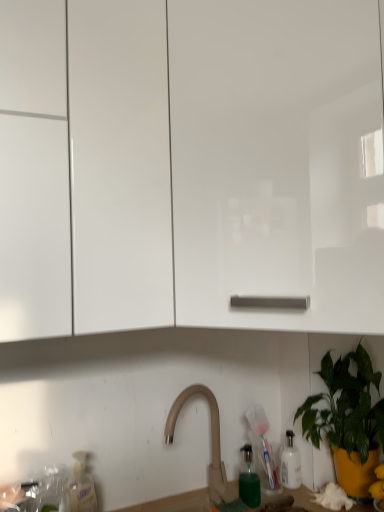
Question: Could beige matte faucet at center be considered to be inside white glossy cabinet at upper left, arranged as the 2th cabinetry when viewed from the right?

Choices:
 (A) yes
 (B) no

Answer: (B)

Question: Does white glossy cabinet at upper left, the first cabinetry from the left, have a lesser width compared to beige matte faucet at center?

Choices:
 (A) yes
 (B) no

Answer: (B)

Question: Is white glossy cabinet at upper left, arranged as the 2th cabinetry when viewed from the right, not within beige matte faucet at center?

Choices:
 (A) yes
 (B) no

Answer: (A)

Question: Is there a large distance between white glossy cabinet at upper left, the first cabinetry from the left, and beige matte faucet at center?

Choices:
 (A) no
 (B) yes

Answer: (A)

Question: Is white glossy cabinet at upper left, arranged as the 2th cabinetry when viewed from the right, facing away from beige matte faucet at center?

Choices:
 (A) yes
 (B) no

Answer: (B)

Question: Is green glossy plant at lower right bigger or smaller than transparent plastic bottle at lower left?

Choices:
 (A) small
 (B) big

Answer: (B)

Question: Considering the positions of green glossy plant at lower right and transparent plastic bottle at lower left in the image, is green glossy plant at lower right wider or thinner than transparent plastic bottle at lower left?

Choices:
 (A) wide
 (B) thin

Answer: (A)

Question: From a real-world perspective, relative to transparent plastic bottle at lower left, is green glossy plant at lower right vertically above or below?

Choices:
 (A) below
 (B) above

Answer: (B)

Question: Is green glossy plant at lower right taller or shorter than transparent plastic bottle at lower left?

Choices:
 (A) tall
 (B) short

Answer: (A)

Question: Considering the positions of white glossy cabinet at upper left, arranged as the 2th cabinetry when viewed from the right, and white matte cabinet at center, which ranks as the 1th cabinetry in right-to-left order, in the image, is white glossy cabinet at upper left, arranged as the 2th cabinetry when viewed from the right, taller or shorter than white matte cabinet at center, which ranks as the 1th cabinetry in right-to-left order,?

Choices:
 (A) tall
 (B) short

Answer: (A)

Question: Relative to white matte cabinet at center, which ranks as the 1th cabinetry in right-to-left order, is white glossy cabinet at upper left, the first cabinetry from the left, in front or behind?

Choices:
 (A) front
 (B) behind

Answer: (B)

Question: From the image's perspective, relative to white matte cabinet at center, which is counted as the 2th cabinetry, starting from the left, is white glossy cabinet at upper left, arranged as the 2th cabinetry when viewed from the right, above or below?

Choices:
 (A) below
 (B) above

Answer: (A)

Question: From a real-world perspective, relative to white matte cabinet at center, which ranks as the 1th cabinetry in right-to-left order, is white glossy cabinet at upper left, the first cabinetry from the left, vertically above or below?

Choices:
 (A) below
 (B) above

Answer: (B)

Question: Considering the positions of white matte cabinet at center, which ranks as the 1th cabinetry in right-to-left order, and green glossy plant at lower right in the image, is white matte cabinet at center, which ranks as the 1th cabinetry in right-to-left order, taller or shorter than green glossy plant at lower right?

Choices:
 (A) short
 (B) tall

Answer: (B)

Question: Is white matte cabinet at center, which ranks as the 1th cabinetry in right-to-left order, inside the boundaries of green glossy plant at lower right, or outside?

Choices:
 (A) outside
 (B) inside

Answer: (A)